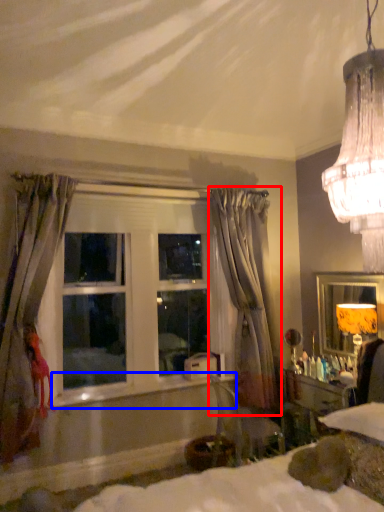
Question: Which object appears closest to the camera in this image, curtain (highlighted by a red box) or window sill (highlighted by a blue box)?

Choices:
 (A) curtain
 (B) window sill

Answer: (B)